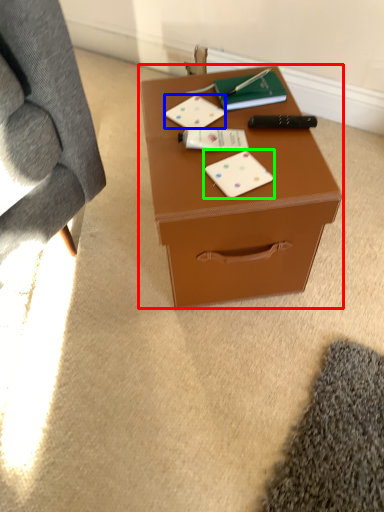
Question: Estimate the real-world distances between objects in this image. Which object is closer to table (highlighted by a red box), card game (highlighted by a blue box) or card game (highlighted by a green box)?

Choices:
 (A) card game
 (B) card game

Answer: (B)